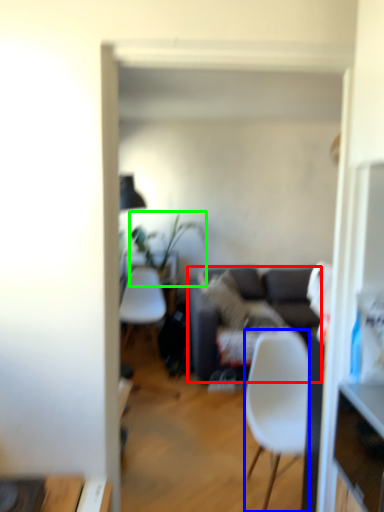
Question: Based on their relative distances, which object is nearer to studio couch (highlighted by a red box)? Choose from chair (highlighted by a blue box) and houseplant (highlighted by a green box).

Choices:
 (A) chair
 (B) houseplant

Answer: (B)